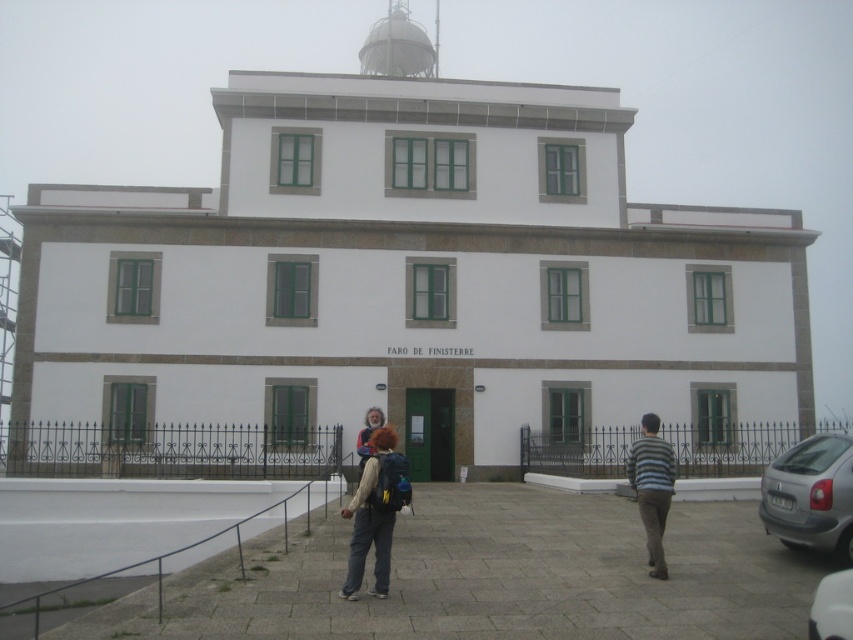
Question: Which point is farther from the camera taking this photo?

Choices:
 (A) (831, 552)
 (B) (648, 470)
 (C) (845, 572)

Answer: (A)

Question: Among these points, which one is farthest from the camera?

Choices:
 (A) (821, 609)
 (B) (648, 458)
 (C) (814, 464)

Answer: (C)

Question: Does striped cotton shirt at right appear on the left side of gray metallic car at lower right?

Choices:
 (A) yes
 (B) no

Answer: (B)

Question: Does matte white backpack at center appear over gray metallic car at lower right?

Choices:
 (A) no
 (B) yes

Answer: (A)

Question: Is silver metallic car at lower right above striped cotton shirt at right?

Choices:
 (A) no
 (B) yes

Answer: (A)

Question: Considering the real-world distances, which object is farthest from the matte white backpack at center?

Choices:
 (A) striped cotton shirt at right
 (B) silver metallic car at lower right

Answer: (B)